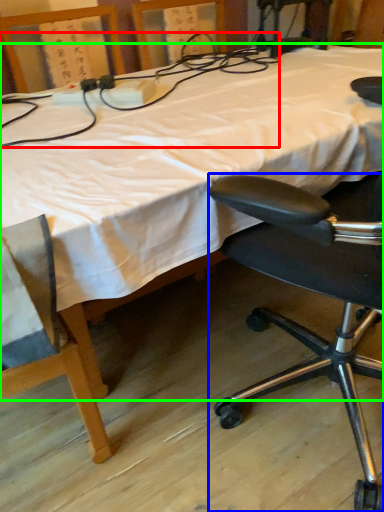
Question: Which object is the closest to the twin (highlighted by a red box)? Choose among these: chair (highlighted by a blue box) or bed (highlighted by a green box).

Choices:
 (A) chair
 (B) bed

Answer: (B)